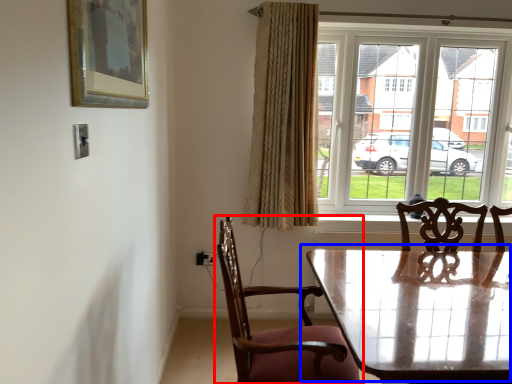
Question: Which object is further to the camera taking this photo, chair (highlighted by a red box) or table (highlighted by a blue box)?

Choices:
 (A) chair
 (B) table

Answer: (B)